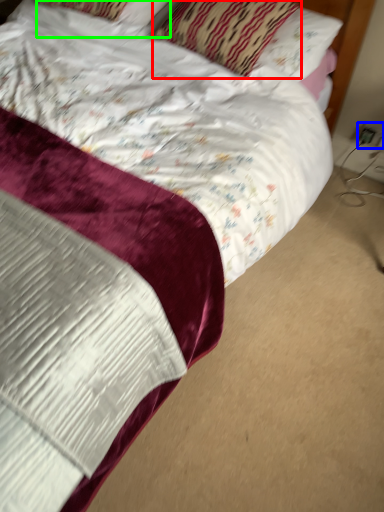
Question: Which object is the closest to the pillow (highlighted by a red box)? Choose among these: electric outlet (highlighted by a blue box) or pillow (highlighted by a green box).

Choices:
 (A) electric outlet
 (B) pillow

Answer: (B)